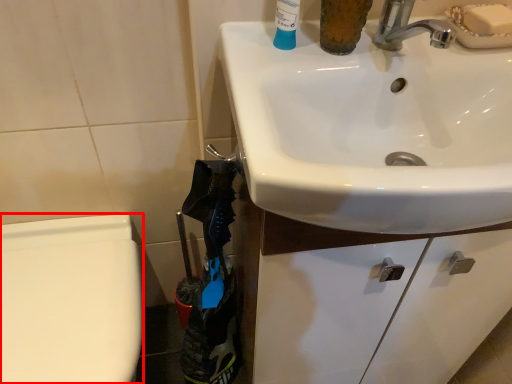
Question: From the image's perspective, what is the correct spatial relationship of bidet (annotated by the red box) in relation to sink?

Choices:
 (A) below
 (B) above

Answer: (A)